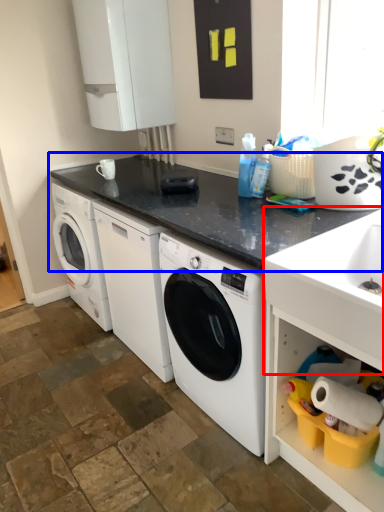
Question: Which point is further to the camera, sink (highlighted by a red box) or countertop (highlighted by a blue box)?

Choices:
 (A) sink
 (B) countertop

Answer: (B)